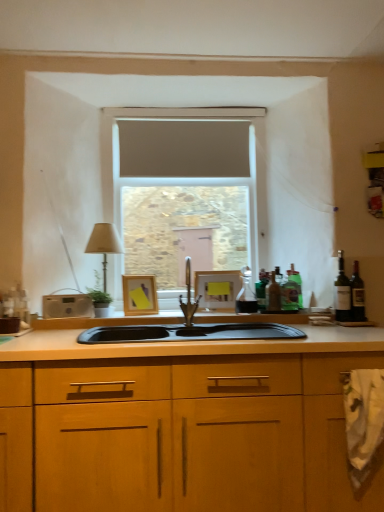
Identify the location of vacant space to the left of translucent glass carafe at center, which is counted as the 1th bottle, starting from the left. The height and width of the screenshot is (512, 384). [x=221, y=311].